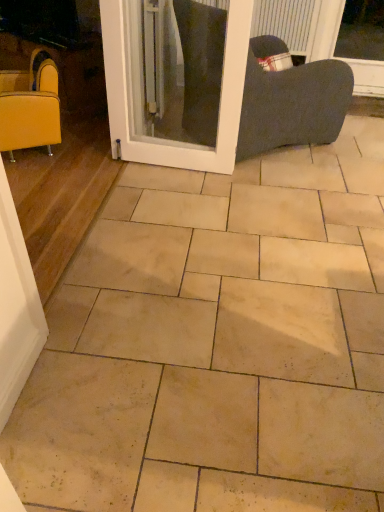
I want to click on space that is in front of matte yellow armchair at left, so click(43, 178).